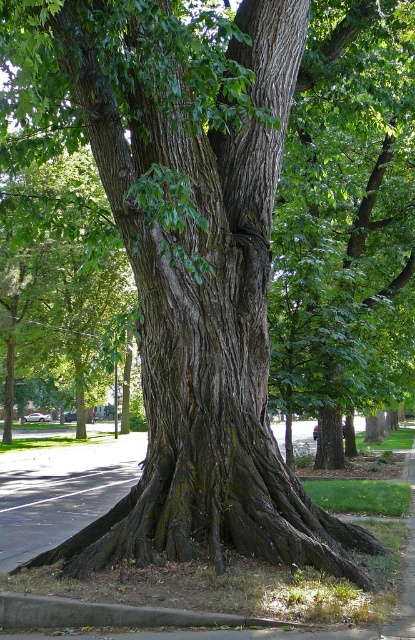
Is gray asphalt at lower left positioned at the back of gray concrete curb at lower center?

That is False.

Identify the location of gray asphalt at lower left. (197, 588).

From the picture: Measure the distance between point (x=268, y=634) and camera.

They are 4.86 meters apart.

Find the location of `gray asphalt at lower left`. gray asphalt at lower left is located at coordinates (197, 588).